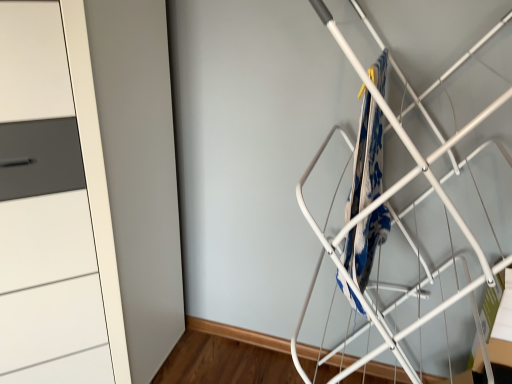
Question: Can you confirm if blue printed fabric at center-right is smaller than white matte cabinet at left?

Choices:
 (A) yes
 (B) no

Answer: (A)

Question: Is blue printed fabric at center-right positioned behind white matte cabinet at left?

Choices:
 (A) no
 (B) yes

Answer: (B)

Question: Is blue printed fabric at center-right positioned before white matte cabinet at left?

Choices:
 (A) yes
 (B) no

Answer: (B)

Question: From the image's perspective, is blue printed fabric at center-right over white matte cabinet at left?

Choices:
 (A) yes
 (B) no

Answer: (A)

Question: Is blue printed fabric at center-right next to white matte cabinet at left?

Choices:
 (A) no
 (B) yes

Answer: (A)

Question: Does blue printed fabric at center-right have a greater width compared to white matte cabinet at left?

Choices:
 (A) yes
 (B) no

Answer: (B)

Question: From a real-world perspective, is white matte cabinet at left positioned under blue printed fabric at center-right based on gravity?

Choices:
 (A) yes
 (B) no

Answer: (A)

Question: Can you confirm if white matte cabinet at left is positioned to the right of blue printed fabric at center-right?

Choices:
 (A) no
 (B) yes

Answer: (A)

Question: Considering the relative positions of white matte cabinet at left and blue printed fabric at center-right in the image provided, is white matte cabinet at left to the left of blue printed fabric at center-right from the viewer's perspective?

Choices:
 (A) no
 (B) yes

Answer: (B)

Question: Is white matte cabinet at left completely or partially outside of blue printed fabric at center-right?

Choices:
 (A) yes
 (B) no

Answer: (A)

Question: Does white matte cabinet at left have a greater width compared to blue printed fabric at center-right?

Choices:
 (A) yes
 (B) no

Answer: (A)

Question: Is white matte cabinet at left positioned far away from blue printed fabric at center-right?

Choices:
 (A) yes
 (B) no

Answer: (B)

Question: Based on their positions, is white matte cabinet at left located to the left or right of blue printed fabric at center-right?

Choices:
 (A) left
 (B) right

Answer: (A)